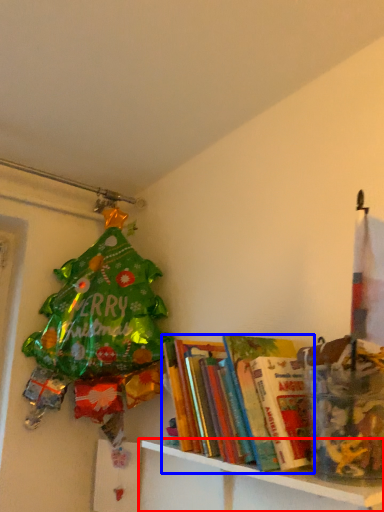
Question: Which object appears closest to the camera in this image, shelf (highlighted by a red box) or book (highlighted by a blue box)?

Choices:
 (A) shelf
 (B) book

Answer: (A)